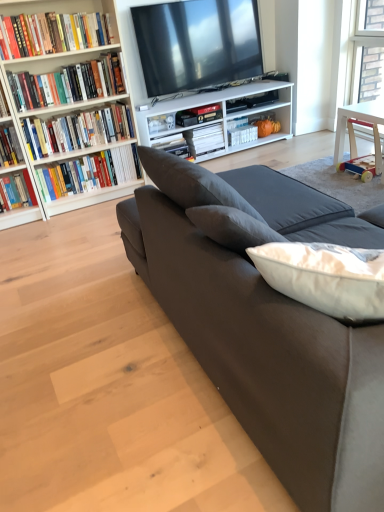
Describe the element at coordinates (242, 134) in the screenshot. I see `white matte book at center, which is the seventh book from front to back` at that location.

Where is `hardcover book at left, which appears as the fifth book when viewed from the back`? This screenshot has width=384, height=512. hardcover book at left, which appears as the fifth book when viewed from the back is located at coordinates (78, 130).

Image resolution: width=384 pixels, height=512 pixels. What do you see at coordinates (69, 83) in the screenshot?
I see `hardcover book at upper left, placed as the 6th book when sorted from back to front` at bounding box center [69, 83].

I want to click on hardcover book at upper left, which is the 2th book from front to back, so click(69, 83).

I want to click on white matte book at center, positioned as the 1th book in back-to-front order, so tap(242, 134).

Consider the image. Is hardcover book at upper left, placed as the 6th book when sorted from back to front, to the left of white matte book at center, which is the seventh book from front to back, from the viewer's perspective?

Yes.

From a real-world perspective, is hardcover book at upper left, which is the 2th book from front to back, on white matte book at center, positioned as the 1th book in back-to-front order?

Yes.

Which of these two, hardcover book at upper left, which is the 2th book from front to back, or white matte book at center, which is the seventh book from front to back, is thinner?

With smaller width is white matte book at center, which is the seventh book from front to back.

Based on the photo, which point is more distant from viewer, (x=89, y=78) or (x=240, y=138)?

The point (x=240, y=138) is more distant.

From the picture: How different are the orientations of white matte book at center, which is the seventh book from front to back, and hardcover book at left, positioned as the fifth book in front-to-back order, in degrees?

The angle between the facing direction of white matte book at center, which is the seventh book from front to back, and the facing direction of hardcover book at left, positioned as the fifth book in front-to-back order, is 0.0933 degrees.

Is white matte book at center, positioned as the 1th book in back-to-front order, taller or shorter than hardcover book at left, positioned as the fifth book in front-to-back order?

white matte book at center, positioned as the 1th book in back-to-front order, is shorter than hardcover book at left, positioned as the fifth book in front-to-back order.

Is point (234, 131) more distant than point (81, 192)?

That is True.

How far apart are white matte book at center, which is the seventh book from front to back, and hardcover book at left, the 3th book when ordered from back to front?

white matte book at center, which is the seventh book from front to back, is 4.37 feet away from hardcover book at left, the 3th book when ordered from back to front.

Does white wood table at right turn towards white matte book at center, which is the seventh book from front to back?

No, white wood table at right is not aimed at white matte book at center, which is the seventh book from front to back.

Is white wood table at right positioned behind white matte book at center, positioned as the 1th book in back-to-front order?

No, it is not.

From a real-world perspective, relative to white matte book at center, which is the seventh book from front to back, is white wood table at right vertically above or below?

From a real-world perspective, white wood table at right is physically above white matte book at center, which is the seventh book from front to back.

Locate an element on the screen. table above the white matte book at center, which is the seventh book from front to back (from a real-world perspective) is located at coordinates (358, 119).

Is hardcover book at left, the 3th book when ordered from back to front, wider than suede couch at center?

Incorrect, the width of hardcover book at left, the 3th book when ordered from back to front, does not surpass that of suede couch at center.

Is suede couch at center completely or partially inside hardcover book at left, positioned as the fifth book in front-to-back order?

No, suede couch at center is not surrounded by hardcover book at left, positioned as the fifth book in front-to-back order.

Between hardcover book at left, positioned as the fifth book in front-to-back order, and suede couch at center, which one is positioned behind?

hardcover book at left, positioned as the fifth book in front-to-back order, is more distant.

How different are the orientations of hardcover book at left, the 3th book when ordered from back to front, and suede couch at center in degrees?

There is a 178-degree angle between the facing directions of hardcover book at left, the 3th book when ordered from back to front, and suede couch at center.

Between suede couch at center and white wood bookshelf at left, which one is positioned in front?

suede couch at center is closer to the camera.

From the picture: What's the angular difference between suede couch at center and white wood bookshelf at left's facing directions?

The facing directions of suede couch at center and white wood bookshelf at left are 177 degrees apart.

Is suede couch at center to the right of white wood bookshelf at left from the viewer's perspective?

Correct, you'll find suede couch at center to the right of white wood bookshelf at left.

Considering the sizes of objects suede couch at center and white wood bookshelf at left in the image provided, who is wider, suede couch at center or white wood bookshelf at left?

With larger width is suede couch at center.

Identify the location of the 2nd book to the left when counting from the hardcover book at left, the 3th book viewed from the front. (53, 33).

Between hardcover book at upper left, which ranks as the seventh book in back-to-front order, and hardcover book at left, the 3th book viewed from the front, which one appears on the left side from the viewer's perspective?

From the viewer's perspective, hardcover book at upper left, which ranks as the seventh book in back-to-front order, appears more on the left side.

Is hardcover book at upper left, which appears as the 1th book when viewed from the front, surrounding hardcover book at left, which appears as the fifth book when viewed from the back?

That's incorrect, hardcover book at left, which appears as the fifth book when viewed from the back, is not inside hardcover book at upper left, which appears as the 1th book when viewed from the front.

From the image's perspective, relative to hardcover book at left, which appears as the fifth book when viewed from the back, is hardcover book at upper left, which appears as the 1th book when viewed from the front, above or below?

From the image's perspective, hardcover book at upper left, which appears as the 1th book when viewed from the front, appears above hardcover book at left, which appears as the fifth book when viewed from the back.

Can you see suede couch at center touching white wood table at right?

suede couch at center is not next to white wood table at right, and they're not touching.

From the image's perspective, would you say suede couch at center is positioned over white wood table at right?

No, from the image's perspective, suede couch at center is not over white wood table at right.

Does suede couch at center have a larger size compared to white wood table at right?

Yes.

From a real-world perspective, is suede couch at center over white wood table at right?

Indeed, from a real-world perspective, suede couch at center stands above white wood table at right.

Starting from the white matte book at center, positioned as the 1th book in back-to-front order, which book is the 4th one to the left? Please provide its 2D coordinates.

[(69, 83)]

Locate an element on the screen. book that is the 3rd one below the hardcover book at left, positioned as the fifth book in front-to-back order (from a real-world perspective) is located at coordinates (242, 134).

Based on the photo, which object lies further to the anchor point hardcover book at left, positioned as the fifth book in front-to-back order, hardcover book at upper left, placed as the 6th book when sorted from back to front, or white wood table at right?

white wood table at right is positioned further to the anchor hardcover book at left, positioned as the fifth book in front-to-back order.

Estimate the real-world distances between objects in this image. Which object is further from white wood bookshelf at left, white matte book at center, which ranks as the 2th book in back-to-front order, or hardcover book at upper left, which appears as the 1th book when viewed from the front?

white matte book at center, which ranks as the 2th book in back-to-front order, is positioned further to the anchor white wood bookshelf at left.

Which object lies further to the anchor point hardcover book at left, which is the fourth book from back to front, white matte book at center, which is the seventh book from front to back, or white wood table at right?

Among the two, white wood table at right is located further to hardcover book at left, which is the fourth book from back to front.

From the picture: Which object lies further to the anchor point matte black tv at upper center, hardcover book at upper left, which appears as the 1th book when viewed from the front, or hardcover book at left, the 3th book when ordered from back to front?

hardcover book at left, the 3th book when ordered from back to front, is further to matte black tv at upper center.

Considering their positions, is white wood bookshelf at left positioned closer to hardcover book at upper left, placed as the 6th book when sorted from back to front, than hardcover book at left, which appears as the fifth book when viewed from the back?

white wood bookshelf at left is positioned closer to the anchor hardcover book at upper left, placed as the 6th book when sorted from back to front.

Which object lies further to the anchor point white matte book at center, which ranks as the 2th book in back-to-front order, hardcover book at left, positioned as the fifth book in front-to-back order, or suede couch at center?

suede couch at center.

Which object lies further to the anchor point suede couch at center, hardcover book at upper left, which appears as the 1th book when viewed from the front, or white matte book at center, positioned as the 1th book in back-to-front order?

white matte book at center, positioned as the 1th book in back-to-front order.

Based on their spatial positions, is hardcover book at left, the 3th book viewed from the front, or hardcover book at upper left, which is the 2th book from front to back, further from hardcover book at upper left, which ranks as the seventh book in back-to-front order?

hardcover book at left, the 3th book viewed from the front.

In order to click on television between white wood bookshelf at left and white matte book at center, the 6th book viewed from the front, in the front-back direction in this screenshot , I will do `click(197, 44)`.

Find the location of a particular element. This screenshot has width=384, height=512. bookcase between suede couch at center and hardcover book at upper left, which appears as the 1th book when viewed from the front, in the front-back direction is located at coordinates (70, 110).

You are a GUI agent. You are given a task and a screenshot of the screen. Output one action in this format:
    pyautogui.click(x=<x>, y=<y>)
    Task: Click on the book located between hardcover book at left, which appears as the fifth book when viewed from the back, and white matte book at center, which ranks as the 2th book in back-to-front order, in the left-right direction
    This screenshot has height=512, width=384.
    Given the screenshot: What is the action you would take?
    pyautogui.click(x=90, y=172)

At what (x,y) coordinates should I click in order to perform the action: click on television between hardcover book at left, which appears as the fifth book when viewed from the back, and white wood table at right. Please return your answer as a coordinate pair (x, y). This screenshot has height=512, width=384. Looking at the image, I should click on (197, 44).